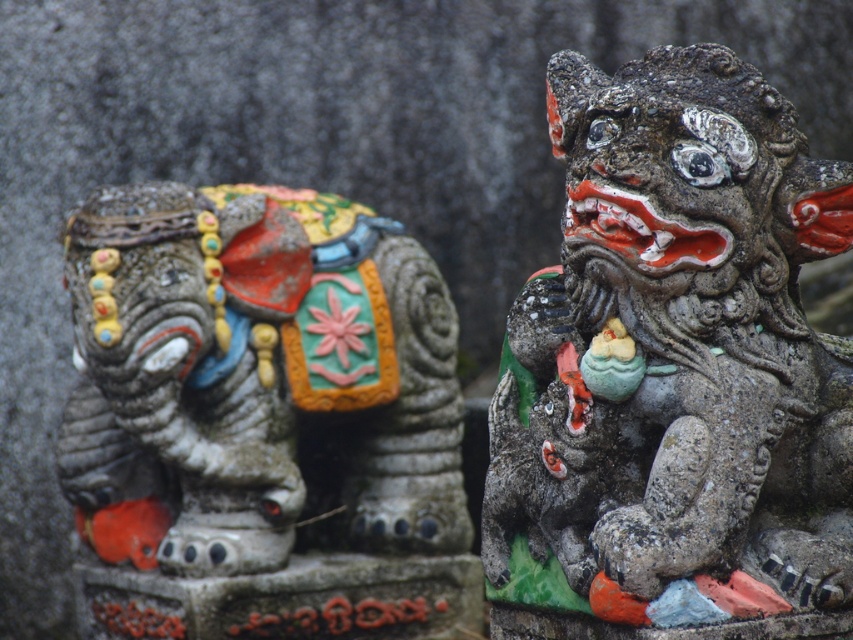
You are an art conservator assessing the space between two statues in a gallery. The stone lion at right and the matte stone elephant at left are positioned side by side. Given that the lion is smaller in width, which statue would require more horizontal space when moving them individually for restoration?

The matte stone elephant at left requires more horizontal space because it has a greater width than the stone lion at right.

You are an art conservator assessing the statues in the image. The stone lion at right and the matte stone elephant at left need to be moved to a new exhibition space. The transport crate can only accommodate statues up to the size of the larger statue. Which statue determines the minimum required size for the crate?

The transport crate must be sized to accommodate the matte stone elephant at left since it is larger than the stone lion at right.

You are standing in front of the two stone statues. There is a point marked at coordinates (674, 371). Which statue is located at that point?

The stone lion at right is located at point (674, 371).